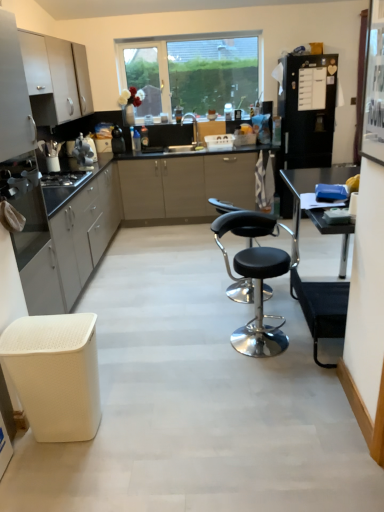
Describe the element at coordinates (248, 229) in the screenshot. I see `black leather stool at center, which is the 2th chair in front-to-back order` at that location.

What do you see at coordinates (75, 244) in the screenshot? This screenshot has width=384, height=512. I see `matte white cabinets at left, which appears as the 4th cabinetry when viewed from the top` at bounding box center [75, 244].

The width and height of the screenshot is (384, 512). In order to click on matte white cabinets at left, arranged as the first cabinetry when ordered from the bottom in this screenshot , I will do tap(75, 244).

In order to click on matte black gas stove at left in this screenshot , I will do `click(65, 178)`.

Where is `white textured stool at lower left`? white textured stool at lower left is located at coordinates (55, 374).

From the image's perspective, is black leather stool at center, which ranks as the first chair in front-to-back order, beneath transparent glass door at upper right?

Yes, from the image's perspective, black leather stool at center, which ranks as the first chair in front-to-back order, is below transparent glass door at upper right.

Would you say black leather stool at center, which ranks as the first chair in front-to-back order, is to the left or to the right of transparent glass door at upper right in the picture?

black leather stool at center, which ranks as the first chair in front-to-back order, is to the left of transparent glass door at upper right.

Would you say black leather stool at center, placed as the second chair when sorted from back to front, is outside transparent glass door at upper right?

Indeed, black leather stool at center, placed as the second chair when sorted from back to front, is completely outside transparent glass door at upper right.

You are a GUI agent. You are given a task and a screenshot of the screen. Output one action in this format:
    pyautogui.click(x=<x>, y=<y>)
    Task: Click on the glass door above the black leather stool at center, placed as the second chair when sorted from back to front (from the image's perspective)
    
    Given the screenshot: What is the action you would take?
    pyautogui.click(x=374, y=86)

Is white textured stool at lower left at the back of matte black gas stove at left?

That's not correct — matte black gas stove at left is not looking away from white textured stool at lower left.

Is point (81, 174) farther from camera compared to point (43, 374)?

Yes, point (81, 174) is farther from viewer.

Is matte black gas stove at left to the left of white textured stool at lower left from the viewer's perspective?

Correct, you'll find matte black gas stove at left to the left of white textured stool at lower left.

Considering the sizes of matte black gas stove at left and white textured stool at lower left in the image, is matte black gas stove at left wider or thinner than white textured stool at lower left?

Considering their sizes, matte black gas stove at left looks broader than white textured stool at lower left.

Is matte black gas stove at left surrounding satin white cabinets at left, which appears as the first cabinetry when viewed from the top?

No.

Considering the positions of objects matte black gas stove at left and satin white cabinets at left, the 4th cabinetry when ordered from bottom to top, in the image provided, who is in front, matte black gas stove at left or satin white cabinets at left, the 4th cabinetry when ordered from bottom to top,?

Positioned in front is matte black gas stove at left.

From a real-world perspective, is matte black gas stove at left physically located above or below satin white cabinets at left, the 4th cabinetry when ordered from bottom to top?

matte black gas stove at left is situated lower than satin white cabinets at left, the 4th cabinetry when ordered from bottom to top, in the real world.

Measure the distance from matte black gas stove at left to satin white cabinets at left, which appears as the first cabinetry when viewed from the top.

matte black gas stove at left is 35.60 inches away from satin white cabinets at left, which appears as the first cabinetry when viewed from the top.

From the image's perspective, relative to black leather stool at center, placed as the second chair when sorted from back to front, is matte white cabinets at left, arranged as the first cabinetry when ordered from the bottom, above or below?

matte white cabinets at left, arranged as the first cabinetry when ordered from the bottom, is above black leather stool at center, placed as the second chair when sorted from back to front.

Considering the sizes of objects matte white cabinets at left, which appears as the 4th cabinetry when viewed from the top, and black leather stool at center, placed as the second chair when sorted from back to front, in the image provided, who is thinner, matte white cabinets at left, which appears as the 4th cabinetry when viewed from the top, or black leather stool at center, placed as the second chair when sorted from back to front,?

Thinner between the two is black leather stool at center, placed as the second chair when sorted from back to front.

Based on the photo, is matte white cabinets at left, arranged as the first cabinetry when ordered from the bottom, to the left of black leather stool at center, which ranks as the first chair in front-to-back order, from the viewer's perspective?

Indeed, matte white cabinets at left, arranged as the first cabinetry when ordered from the bottom, is positioned on the left side of black leather stool at center, which ranks as the first chair in front-to-back order.

What's the angular difference between matte white cabinets at left, arranged as the first cabinetry when ordered from the bottom, and black leather stool at center, which ranks as the first chair in front-to-back order,'s facing directions?

The angular difference between matte white cabinets at left, arranged as the first cabinetry when ordered from the bottom, and black leather stool at center, which ranks as the first chair in front-to-back order, is 89.9 degrees.

Can you tell me how much metallic silver toaster at left and white matte cabinet at upper left, which is counted as the second cabinetry, starting from the bottom, differ in facing direction?

The angular difference between metallic silver toaster at left and white matte cabinet at upper left, which is counted as the second cabinetry, starting from the bottom, is 2.17 degrees.

Does metallic silver toaster at left have a smaller size compared to white matte cabinet at upper left, positioned as the third cabinetry in top-to-bottom order?

Actually, metallic silver toaster at left might be larger than white matte cabinet at upper left, positioned as the third cabinetry in top-to-bottom order.

Does point (43, 232) come in front of point (20, 154)?

That is False.

In the scene shown: Is metallic silver toaster at left far from white matte cabinet at upper left, positioned as the third cabinetry in top-to-bottom order?

metallic silver toaster at left is actually quite close to white matte cabinet at upper left, positioned as the third cabinetry in top-to-bottom order.

Is satin white cabinets at left, which appears as the first cabinetry when viewed from the top, next to black leather stool at center, placed as the second chair when sorted from back to front, and touching it?

They are not placed beside each other.

Which object is positioned more to the left, satin white cabinets at left, which appears as the first cabinetry when viewed from the top, or black leather stool at center, which ranks as the first chair in front-to-back order?

Positioned to the left is satin white cabinets at left, which appears as the first cabinetry when viewed from the top.

In the image, is satin white cabinets at left, the 4th cabinetry when ordered from bottom to top, positioned in front of or behind black leather stool at center, placed as the second chair when sorted from back to front?

satin white cabinets at left, the 4th cabinetry when ordered from bottom to top, is behind black leather stool at center, placed as the second chair when sorted from back to front.

Is matte white cabinets at left, which appears as the 4th cabinetry when viewed from the top, positioned beyond the bounds of matte black gas stove at left?

That's correct, matte white cabinets at left, which appears as the 4th cabinetry when viewed from the top, is outside of matte black gas stove at left.

Which is more to the left, matte white cabinets at left, arranged as the first cabinetry when ordered from the bottom, or matte black gas stove at left?

Positioned to the left is matte black gas stove at left.

Does matte white cabinets at left, which appears as the 4th cabinetry when viewed from the top, turn towards matte black gas stove at left?

No, matte white cabinets at left, which appears as the 4th cabinetry when viewed from the top, does not turn towards matte black gas stove at left.

Locate an element on the screen. glass door on the right of the black leather stool at center, placed as the second chair when sorted from back to front is located at coordinates (374, 86).

Find the location of `gas stove on the left side of white textured stool at lower left`. gas stove on the left side of white textured stool at lower left is located at coordinates coord(65,178).

From the image, which object appears to be farther from matte white cabinets at left, which appears as the 4th cabinetry when viewed from the top, transparent glass door at upper right or satin white cabinets at left, the 4th cabinetry when ordered from bottom to top?

transparent glass door at upper right.

Which object lies further to the anchor point black leather stool at center, which ranks as the first chair in front-to-back order, metallic silver toaster at left or clear glass window at upper center?

clear glass window at upper center is further to black leather stool at center, which ranks as the first chair in front-to-back order.

From the image, which object appears to be farther from transparent glass door at upper right, black matte refrigerator at right, positioned as the second appliance in left-to-right order, or metallic silver toaster at left?

Based on the image, black matte refrigerator at right, positioned as the second appliance in left-to-right order, appears to be further to transparent glass door at upper right.

Which object lies nearer to the anchor point black matte refrigerator at right, which is counted as the first appliance, starting from the right, white matte cabinet at upper left, the 2th cabinetry from the top, or transparent glass door at upper right?

The object closer to black matte refrigerator at right, which is counted as the first appliance, starting from the right, is white matte cabinet at upper left, the 2th cabinetry from the top.

Looking at the image, which one is located closer to transparent glass door at upper right, matte black gas stove at left or satin white cabinets at left, the 4th cabinetry when ordered from bottom to top?

The object closer to transparent glass door at upper right is matte black gas stove at left.

When comparing their distances from white matte cabinet at upper left, the third cabinetry from the bottom, does satin white cabinets at left, the 4th cabinetry when ordered from bottom to top, or black matte refrigerator at right, which is counted as the first appliance, starting from the right, seem further?

The object further to white matte cabinet at upper left, the third cabinetry from the bottom, is black matte refrigerator at right, which is counted as the first appliance, starting from the right.

Considering their positions, is white matte cabinet at upper left, which is counted as the second cabinetry, starting from the bottom, positioned further to black leather stool at center, which is the 2th chair in front-to-back order, than transparent glass door at upper right?

white matte cabinet at upper left, which is counted as the second cabinetry, starting from the bottom, is positioned further to the anchor black leather stool at center, which is the 2th chair in front-to-back order.

Based on their spatial positions, is black leather stool at center, which ranks as the first chair in front-to-back order, or white matte cabinet at upper left, which is counted as the second cabinetry, starting from the bottom, further from matte white cabinets at left, arranged as the first cabinetry when ordered from the bottom?

The object further to matte white cabinets at left, arranged as the first cabinetry when ordered from the bottom, is black leather stool at center, which ranks as the first chair in front-to-back order.

Locate an element on the screen. The height and width of the screenshot is (512, 384). cabinetry between white matte cabinet at upper left, the 2th cabinetry from the top, and satin silver toaster at left, arranged as the first appliance when viewed from the front, in the front-back direction is located at coordinates tap(56, 78).

This screenshot has height=512, width=384. In order to click on chair positioned between black leather stool at center, which ranks as the first chair in front-to-back order, and satin silver toaster at left, marked as the 2th appliance in a back-to-front arrangement, from near to far in this screenshot , I will do `click(248, 229)`.

I want to click on bar stool situated between matte white cabinets at left, which appears as the 4th cabinetry when viewed from the top, and black leather stool at center, which is the 2th chair in front-to-back order, from left to right, so click(x=55, y=374).

This screenshot has width=384, height=512. In order to click on gas stove between satin white cabinets at left, the 4th cabinetry when ordered from bottom to top, and white textured stool at lower left, in the vertical direction in this screenshot , I will do `click(65, 178)`.